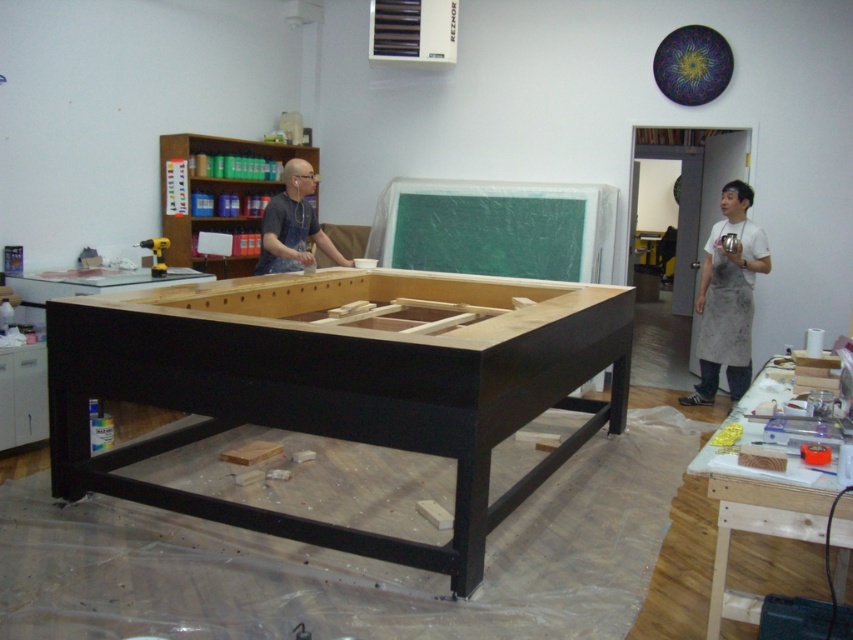
You are a visitor in the workshop and want to see both the black wood table at center and the wooden at center. Which object should you look at first to see both?

You should look at the black wood table at center first because the wooden at center is behind it, so you can see both by looking at the black wood table at center first and then noticing the wooden at center behind it.

You are standing in the workshop and see two points marked in the image. Which point is closer to you, point (727, 227) or point (291, 244)?

Point (727, 227) is further to the viewer than point (291, 244), so point (291, 244) is closer to you.

You are a visitor in the workshop and want to hang a small picture between the white apron at right and the metallic yellow drill at left. Which object should you place the picture closer to if you want it to be at eye level?

The white apron at right is much taller than the metallic yellow drill at left, so placing the picture closer to the white apron at right would position it at eye level.